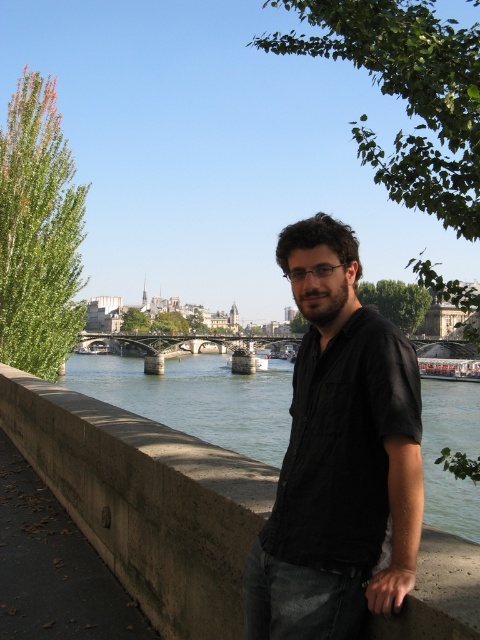
Looking at this image, is black matte shirt at center above concrete ledge at center?

Indeed, black matte shirt at center is positioned over concrete ledge at center.

Is black matte shirt at center further to camera compared to concrete ledge at center?

Yes, it is.

This screenshot has height=640, width=480. What do you see at coordinates (338, 456) in the screenshot? I see `black matte shirt at center` at bounding box center [338, 456].

Identify the location of black matte shirt at center. (338, 456).

Can you confirm if concrete ledge at center is smaller than concrete bridge at center?

Correct, concrete ledge at center occupies less space than concrete bridge at center.

Is the position of concrete ledge at center more distant than that of concrete bridge at center?

That is False.

Who is more distant from viewer, (x=156, y=509) or (x=236, y=364)?

The point (x=236, y=364) is behind.

You are a GUI agent. You are given a task and a screenshot of the screen. Output one action in this format:
    pyautogui.click(x=<x>, y=<y>)
    Task: Click on the concrete ledge at center
    The image size is (480, 640).
    Given the screenshot: What is the action you would take?
    pyautogui.click(x=145, y=500)

Is black matte shirt at center below concrete bridge at center?

Incorrect, black matte shirt at center is not positioned below concrete bridge at center.

Is black matte shirt at center smaller than concrete bridge at center?

Indeed, black matte shirt at center has a smaller size compared to concrete bridge at center.

Locate an element on the screen. black matte shirt at center is located at coordinates (338, 456).